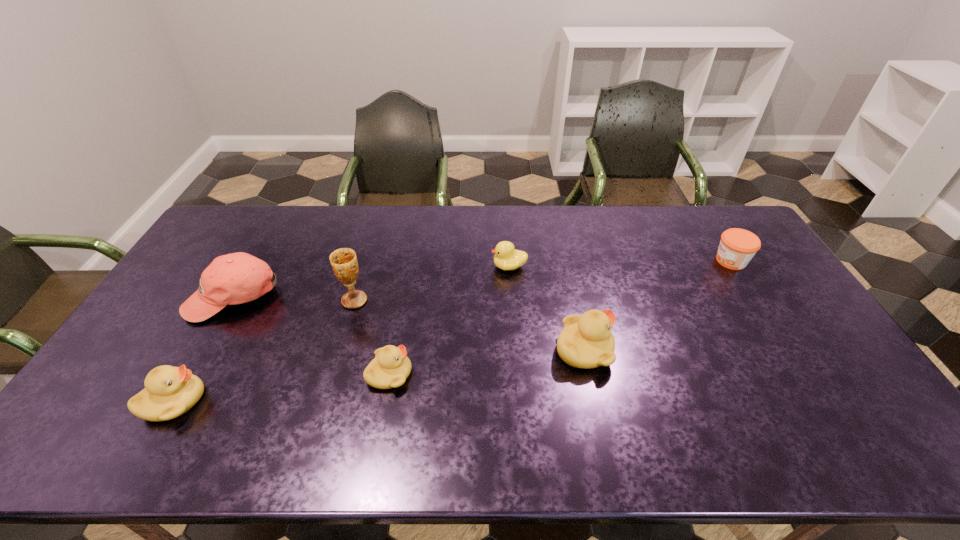
In order to click on vacant space located on the front-facing side of the fourth tallest object in this screenshot , I will do `click(262, 401)`.

The width and height of the screenshot is (960, 540). What are the coordinates of `free space located 0.220m on the front-facing side of the second duckling from left to right` in the screenshot? It's located at (494, 374).

This screenshot has height=540, width=960. Find the location of `free location located 0.400m on the front-facing side of the sixth object from left to right`. free location located 0.400m on the front-facing side of the sixth object from left to right is located at coordinates (757, 350).

Identify the location of free space located 0.300m on the front label of the jam. This screenshot has height=540, width=960. (625, 261).

This screenshot has width=960, height=540. In order to click on free space located on the front label of the jam in this screenshot , I will do `click(622, 261)`.

Identify the location of free space located on the front label of the jam. tap(672, 261).

I want to click on free location located 0.130m on the beak of the third object from right to left, so click(x=452, y=266).

In order to click on vacant space located 0.400m on the beak of the third object from right to left in this screenshot , I will do `click(372, 266)`.

This screenshot has height=540, width=960. What are the coordinates of `vacant space located on the beak of the third object from right to left` in the screenshot? It's located at (434, 266).

Where is `vacant space located on the front of the chalice`? This screenshot has height=540, width=960. vacant space located on the front of the chalice is located at coordinates (346, 330).